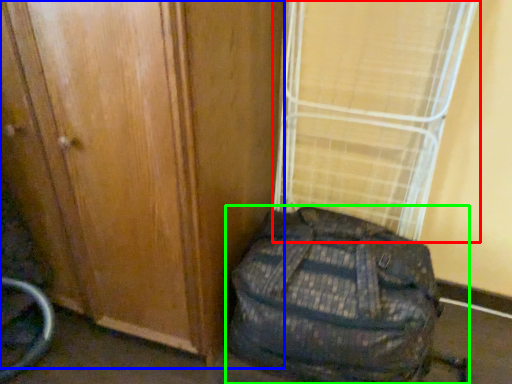
Question: Estimate the real-world distances between objects in this image. Which object is farther from curtain (highlighted by a red box), door (highlighted by a blue box) or backpack (highlighted by a green box)?

Choices:
 (A) door
 (B) backpack

Answer: (A)